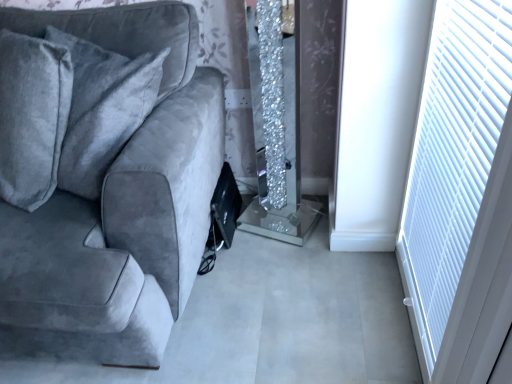
Question: Is white textured blind at right placed right next to velvet gray couch at left?

Choices:
 (A) no
 (B) yes

Answer: (A)

Question: Can you confirm if white textured blind at right is positioned to the left of velvet gray couch at left?

Choices:
 (A) no
 (B) yes

Answer: (A)

Question: From the image's perspective, is white textured blind at right located beneath velvet gray couch at left?

Choices:
 (A) no
 (B) yes

Answer: (B)

Question: From the image's perspective, is white textured blind at right on top of velvet gray couch at left?

Choices:
 (A) no
 (B) yes

Answer: (A)

Question: Is velvet gray couch at left a part of white textured blind at right?

Choices:
 (A) no
 (B) yes

Answer: (A)

Question: Is white textured blind at right positioned before velvet gray couch at left?

Choices:
 (A) yes
 (B) no

Answer: (A)

Question: Is velvet gray couch at left behind white textured blind at right?

Choices:
 (A) no
 (B) yes

Answer: (B)

Question: Would you say velvet gray couch at left is a long distance from white textured blind at right?

Choices:
 (A) yes
 (B) no

Answer: (B)

Question: Does velvet gray couch at left touch white textured blind at right?

Choices:
 (A) yes
 (B) no

Answer: (B)

Question: Is velvet gray couch at left positioned beyond the bounds of white textured blind at right?

Choices:
 (A) no
 (B) yes

Answer: (B)

Question: From a real-world perspective, is velvet gray couch at left on top of white textured blind at right?

Choices:
 (A) no
 (B) yes

Answer: (A)

Question: From a real-world perspective, is velvet gray couch at left beneath white textured blind at right?

Choices:
 (A) yes
 (B) no

Answer: (A)

Question: In terms of height, does velvet gray couch at left look taller or shorter compared to white textured blind at right?

Choices:
 (A) tall
 (B) short

Answer: (A)